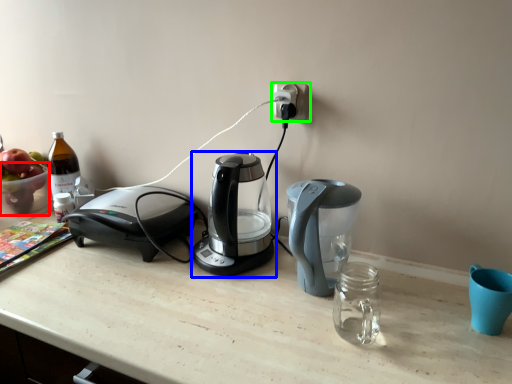
Question: Which object is the farthest from bowl (highlighted by a red box)? Choose among these: coffee maker (highlighted by a blue box) or power plugs and sockets (highlighted by a green box).

Choices:
 (A) coffee maker
 (B) power plugs and sockets

Answer: (B)